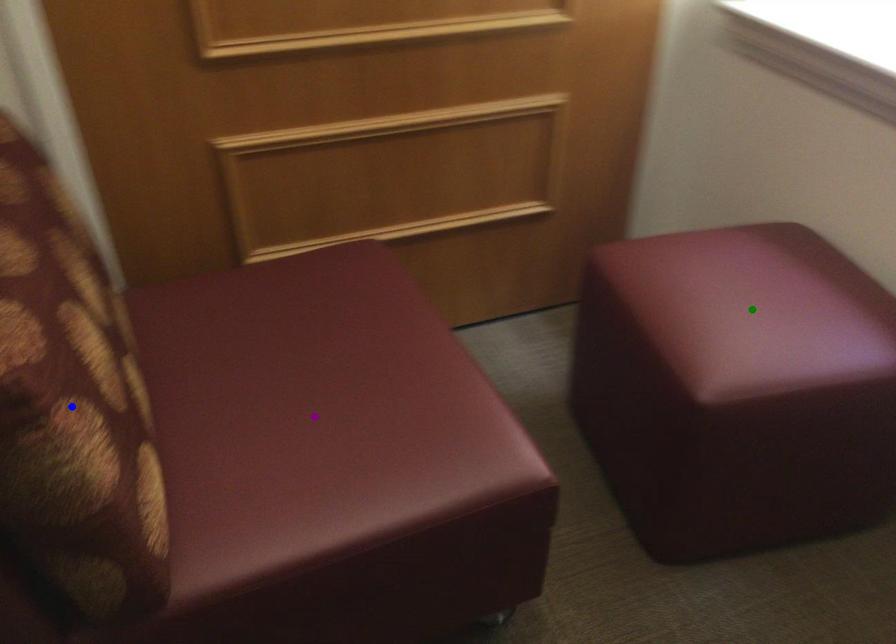
Order these from nearest to farthest:
purple point
green point
blue point

blue point
purple point
green point